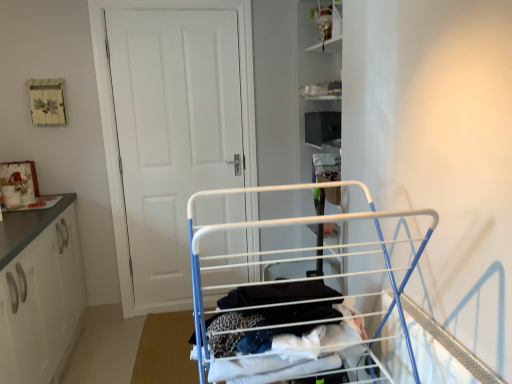
Question: Can you confirm if matte white cabinet at upper center is positioned to the left of white fabric clothes at center?

Choices:
 (A) yes
 (B) no

Answer: (B)

Question: From the image's perspective, does matte white cabinet at upper center appear higher than white fabric clothes at center?

Choices:
 (A) yes
 (B) no

Answer: (A)

Question: Is matte white cabinet at upper center to the right of white fabric clothes at center from the viewer's perspective?

Choices:
 (A) yes
 (B) no

Answer: (A)

Question: From a real-world perspective, is matte white cabinet at upper center located higher than white fabric clothes at center?

Choices:
 (A) no
 (B) yes

Answer: (B)

Question: Is matte white cabinet at upper center beside white fabric clothes at center?

Choices:
 (A) yes
 (B) no

Answer: (B)

Question: From the image's perspective, relative to white matte cabinet at left, is white fabric clothes at center above or below?

Choices:
 (A) above
 (B) below

Answer: (A)

Question: Considering the positions of white fabric clothes at center and white matte cabinet at left in the image, is white fabric clothes at center wider or thinner than white matte cabinet at left?

Choices:
 (A) thin
 (B) wide

Answer: (A)

Question: Is white fabric clothes at center bigger or smaller than white matte cabinet at left?

Choices:
 (A) small
 (B) big

Answer: (A)

Question: Is point (271, 292) positioned closer to the camera than point (46, 211)?

Choices:
 (A) closer
 (B) farther

Answer: (A)

Question: Is white metal drying rack at center in front of or behind matte white cabinet at upper center in the image?

Choices:
 (A) front
 (B) behind

Answer: (A)

Question: In the image, is white metal drying rack at center on the left side or the right side of matte white cabinet at upper center?

Choices:
 (A) left
 (B) right

Answer: (A)

Question: Is point (245, 316) positioned closer to the camera than point (335, 6)?

Choices:
 (A) farther
 (B) closer

Answer: (B)

Question: From their relative heights in the image, would you say white metal drying rack at center is taller or shorter than matte white cabinet at upper center?

Choices:
 (A) tall
 (B) short

Answer: (A)

Question: From a real-world perspective, is white fabric clothes at center above or below white metal drying rack at center?

Choices:
 (A) above
 (B) below

Answer: (B)

Question: From the image's perspective, is white fabric clothes at center positioned above or below white metal drying rack at center?

Choices:
 (A) below
 (B) above

Answer: (A)